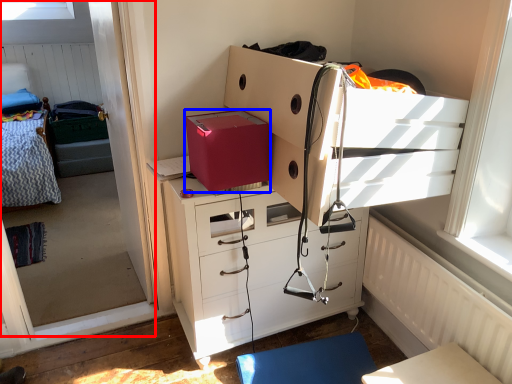
Question: Which of the following is the closest to the observer, window screen (highlighted by a red box) or shoe box (highlighted by a blue box)?

Choices:
 (A) window screen
 (B) shoe box

Answer: (A)